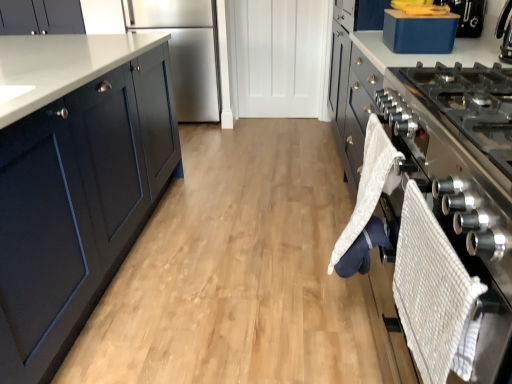
Question: From their relative heights in the image, would you say blue plastic container at upper right is taller or shorter than satin silver oven at right?

Choices:
 (A) tall
 (B) short

Answer: (B)

Question: From a real-world perspective, is blue plastic container at upper right positioned above or below satin silver oven at right?

Choices:
 (A) above
 (B) below

Answer: (A)

Question: Based on their relative distances, which object is farther from the stainless steel refrigerator at center?

Choices:
 (A) blue plastic container at upper right
 (B) matte dark blue cabinet at upper left
 (C) satin silver oven at right

Answer: (C)

Question: Which object is positioned farthest from the blue plastic container at upper right?

Choices:
 (A) stainless steel refrigerator at center
 (B) satin silver oven at right
 (C) matte dark blue cabinet at upper left

Answer: (C)